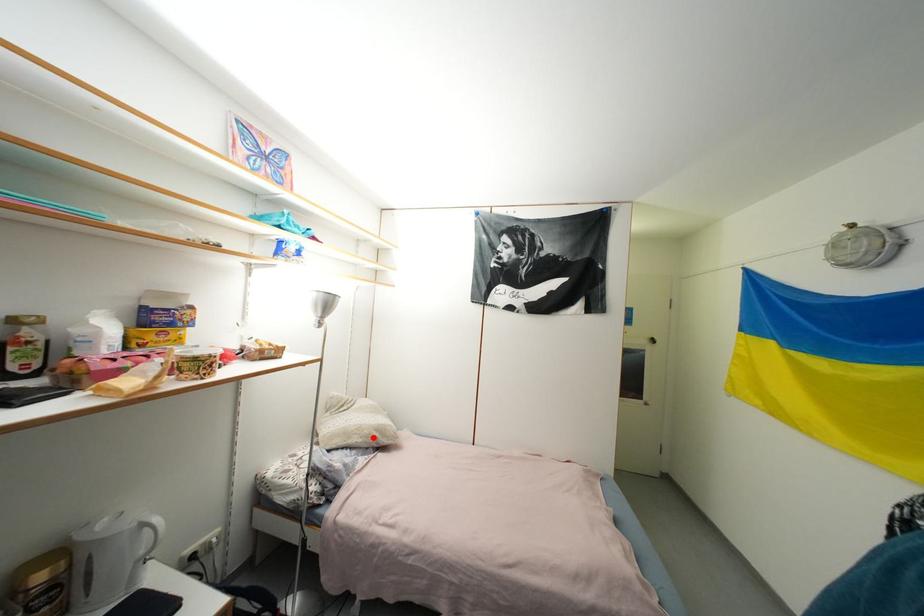
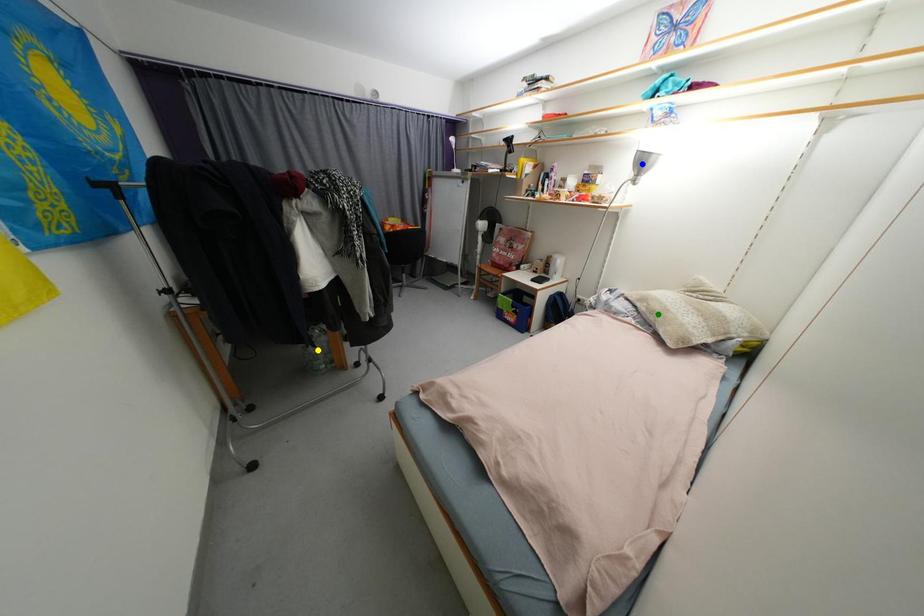
Question: I am providing you with two images of the same scene from different viewpoints. A red point is marked on the first image. You are given multiple points on the second image. Which point in image 2 represents the same 3d spot as the red point in image 1?

Choices:
 (A) blue point
 (B) yellow point
 (C) green point

Answer: (C)